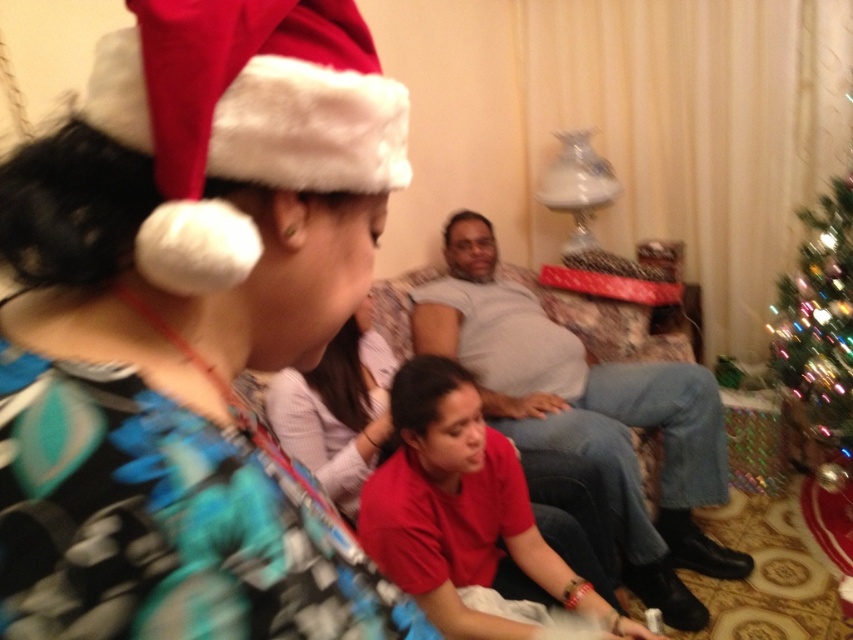
Question: Does green glittering christmas tree at right appear on the left side of matte pink sweater at center?

Choices:
 (A) yes
 (B) no

Answer: (B)

Question: Which of the following is the farthest from the observer?

Choices:
 (A) (381, 412)
 (B) (799, 365)

Answer: (B)

Question: Estimate the real-world distances between objects in this image. Which object is farther from the light gray cotton shirt at center?

Choices:
 (A) printed fabric dress at upper left
 (B) matte pink sweater at center
 (C) green glittering christmas tree at right

Answer: (A)

Question: Which point is farther to the camera?

Choices:
 (A) red velvet santa hat at upper left
 (B) printed fabric dress at upper left
 (C) matte pink sweater at center
 (D) light gray cotton shirt at center

Answer: (D)

Question: Does red velvet santa hat at upper left have a lesser width compared to light gray cotton shirt at center?

Choices:
 (A) no
 (B) yes

Answer: (B)

Question: Does printed fabric dress at upper left appear on the right side of red velvet santa hat at upper left?

Choices:
 (A) no
 (B) yes

Answer: (A)